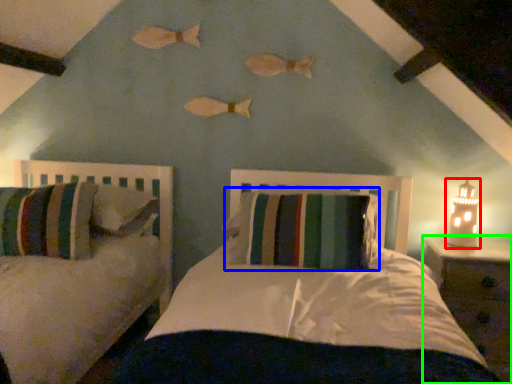
Question: Estimate the real-world distances between objects in this image. Which object is farther from table lamp (highlighted by a red box), pillow (highlighted by a blue box) or nightstand (highlighted by a green box)?

Choices:
 (A) pillow
 (B) nightstand

Answer: (A)